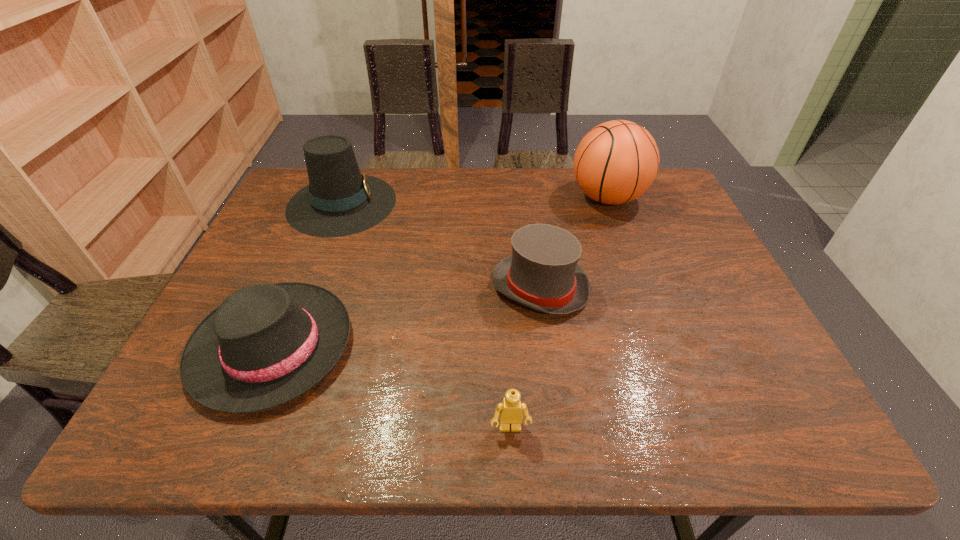
Find the location of a particular element. The height and width of the screenshot is (540, 960). vacant space that is in between the rightmost dress hat and the Lego is located at coordinates (525, 357).

In order to click on object that is the fourth closest to the farthest dress hat in this screenshot , I will do click(x=511, y=410).

Find the location of a particular element. object that stands as the fourth closest to the rightmost object is located at coordinates (511, 410).

At what (x,y) coordinates should I click in order to perform the action: click on dress hat that stands as the closest to the rightmost dress hat. Please return your answer as a coordinate pair (x, y). The image size is (960, 540). Looking at the image, I should click on (339, 201).

Select which dress hat is the second closest to the rightmost dress hat. Please provide its 2D coordinates. Your answer should be formatted as a tuple, i.e. [(x, y)], where the tuple contains the x and y coordinates of a point satisfying the conditions above.

[(266, 344)]

At what (x,y) coordinates should I click in order to perform the action: click on vacant space that satisfies the following two spatial constraints: 1. on the front-facing side of the farthest dress hat; 2. on the right side of the rightmost dress hat. Please return your answer as a coordinate pair (x, y). This screenshot has height=540, width=960. Looking at the image, I should click on (309, 287).